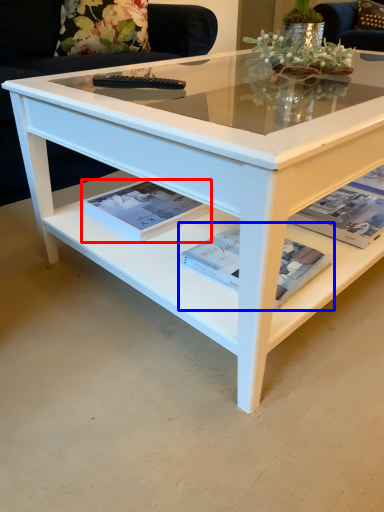
Question: Which of the following is the closest to the observer, magazine (highlighted by a red box) or magazine (highlighted by a blue box)?

Choices:
 (A) magazine
 (B) magazine

Answer: (B)